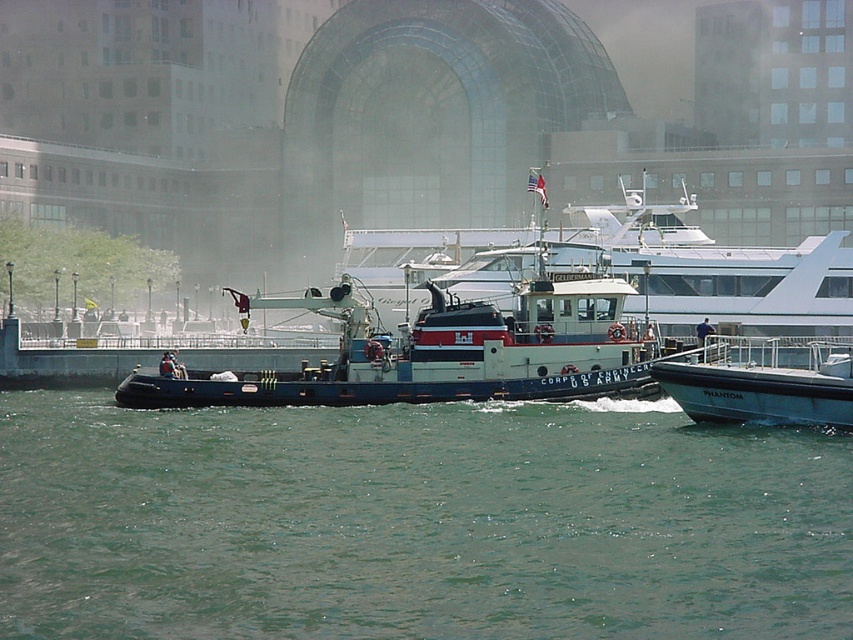
Question: Estimate the real-world distances between objects in this image. Which object is farther from the white glossy tugboat at center?

Choices:
 (A) white matte boat at right
 (B) greenish water at center

Answer: (B)

Question: From the image, what is the correct spatial relationship of greenish water at center in relation to white matte boat at right?

Choices:
 (A) above
 (B) below

Answer: (B)

Question: Is blue matte tugboat at center bigger than white matte boat at right?

Choices:
 (A) yes
 (B) no

Answer: (B)

Question: Among these objects, which one is nearest to the camera?

Choices:
 (A) blue matte tugboat at center
 (B) white matte boat at right
 (C) greenish water at center
 (D) white glossy tugboat at center

Answer: (C)

Question: Which point is farther from the camera taking this photo?

Choices:
 (A) (253, 483)
 (B) (421, 317)
 (C) (548, 256)

Answer: (C)

Question: Is greenish water at center positioned before white matte boat at right?

Choices:
 (A) yes
 (B) no

Answer: (A)